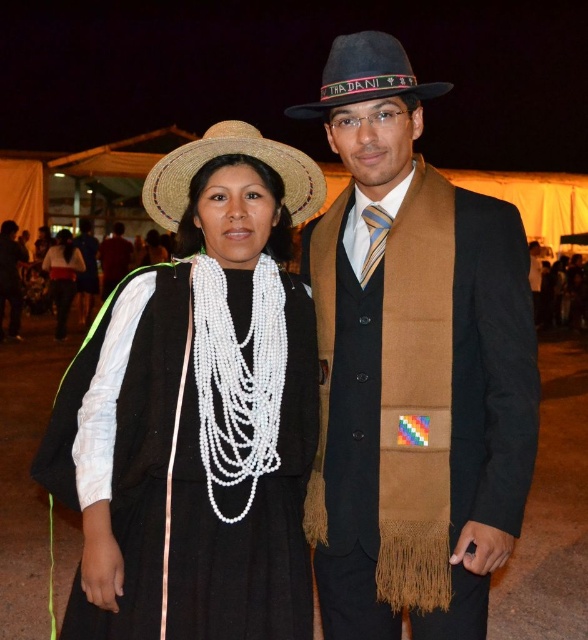
You are at a festival and notice two accessories worn by a woman. The black woven hat at upper left and the white beaded necklace at center. Which accessory is positioned to the right of the other?

The black woven hat at upper left is to the right of the white beaded necklace at center.

You are attending a cultural event and see two hats, the black woven hat at upper left and the black felt cowboy hat at upper center. Which hat is located to the left of the other?

The black woven hat at upper left is positioned on the left side of black felt cowboy hat at upper center, so the black woven hat at upper left is to the left of the black felt cowboy hat at upper center.